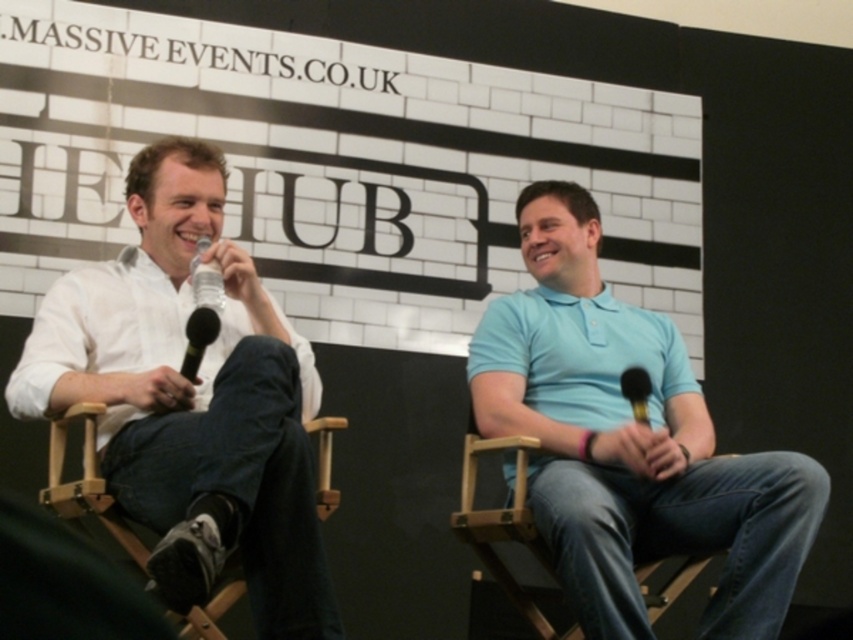
Question: Which point appears closest to the camera in this image?

Choices:
 (A) (335, 499)
 (B) (643, 422)

Answer: (A)

Question: Which point appears farthest from the camera in this image?

Choices:
 (A) (102, 426)
 (B) (169, 445)
 (C) (584, 348)

Answer: (C)

Question: Can you confirm if light blue cotton polo shirt at right is smaller than wooden chair at center?

Choices:
 (A) no
 (B) yes

Answer: (A)

Question: Among these objects, which one is farthest from the camera?

Choices:
 (A) wooden chair at lower left
 (B) light blue cotton polo shirt at right
 (C) black matte microphone at left

Answer: (B)

Question: Considering the relative positions of white matte polo shirt at left and wooden chair at center in the image provided, where is white matte polo shirt at left located with respect to wooden chair at center?

Choices:
 (A) below
 (B) above

Answer: (B)

Question: Does light blue cotton polo shirt at right appear on the left side of wooden chair at center?

Choices:
 (A) yes
 (B) no

Answer: (B)